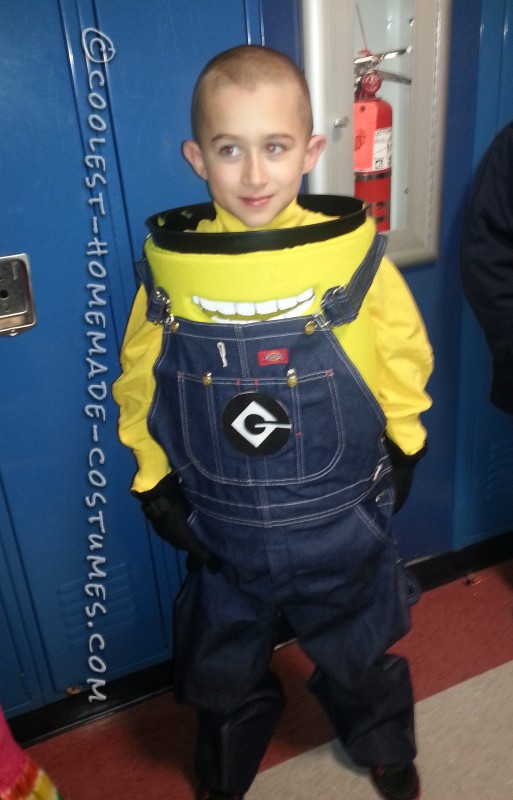
The height and width of the screenshot is (800, 513). What are the coordinates of `fire extinguisher` in the screenshot? It's located at (386, 197).